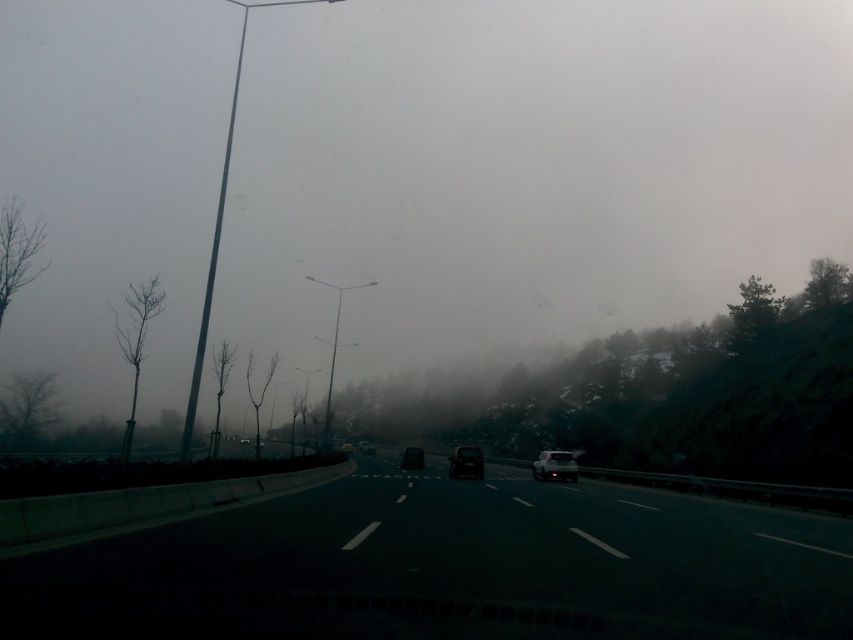
You are driving a car and see the satin white sedan at center ahead. Based on its position, can you estimate how far it is from the left concrete barrier?

The satin white sedan at center is located at point (555, 465), which is closer to the left concrete barrier than the right edge of the highway.

You are a driver who just entered the highway and wants to stay in the correct lane. According to the image, where is the black asphalt highway at center located?

The black asphalt highway at center is located at point (450, 566).

You are a driver navigating a highway during overcast weather. You notice a sedan at point (555, 465). Is the sedan positioned in the leftmost lane or the rightmost lane?

The sedan at point (555, 465) is positioned in the center of the highway, so it is not in either the leftmost or rightmost lane.